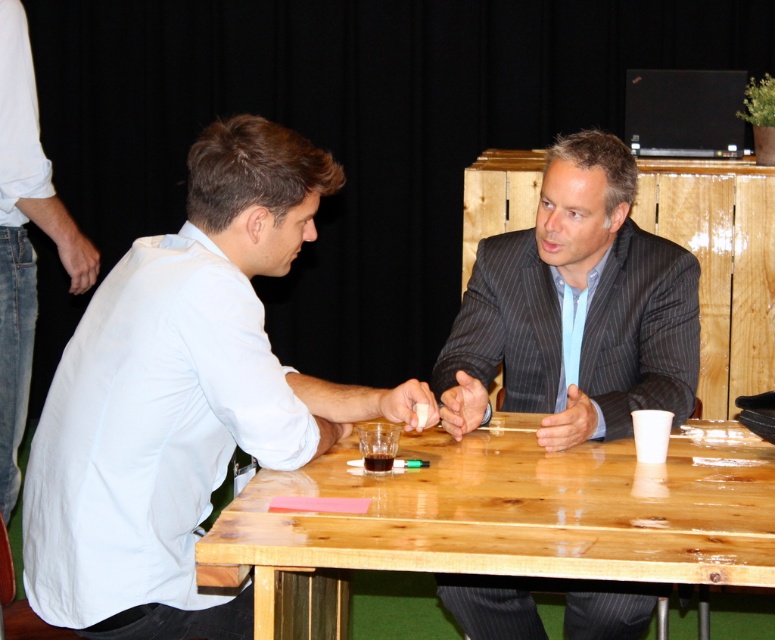
Does point (546, 369) lie behind point (5, 324)?

No, it is in front of (5, 324).

Locate an element on the screen. The height and width of the screenshot is (640, 775). dark gray pinstripe suit at center is located at coordinates (574, 308).

Identify the location of dark gray pinstripe suit at center. The image size is (775, 640). (574, 308).

In order to click on dark gray pinstripe suit at center in this screenshot , I will do `click(574, 308)`.

Does wooden table at center have a lesser width compared to white cotton shirt at left?

Incorrect, wooden table at center's width is not less than white cotton shirt at left's.

Is point (660, 476) more distant than point (43, 212)?

No, it is not.

Who is more distant from viewer, (748, 504) or (5, 198)?

The point (5, 198) is behind.

Where is `wooden table at center`? wooden table at center is located at coordinates (501, 518).

Can you confirm if white matte shirt at left is positioned above white cotton shirt at left?

No.

Does white matte shirt at left have a larger size compared to white cotton shirt at left?

Indeed, white matte shirt at left has a larger size compared to white cotton shirt at left.

This screenshot has height=640, width=775. In order to click on white matte shirt at left in this screenshot , I will do `click(181, 397)`.